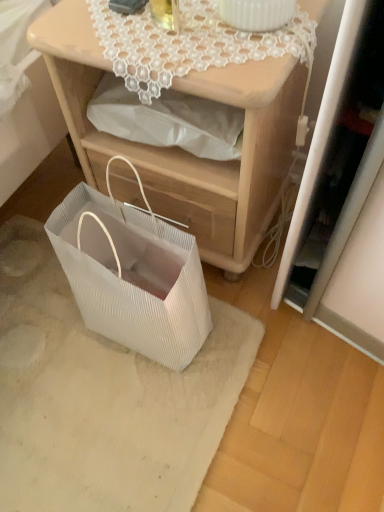
Question: From the image's perspective, relative to matte wood nightstand at center, is white pleated paper bag at lower left above or below?

Choices:
 (A) below
 (B) above

Answer: (A)

Question: Is point (82, 183) positioned closer to the camera than point (200, 210)?

Choices:
 (A) farther
 (B) closer

Answer: (B)

Question: Considering the real-world distances, which object is closest to the white lace doily at upper center?

Choices:
 (A) matte wood nightstand at center
 (B) white pleated paper bag at lower left
 (C) white textured mat at lower left

Answer: (A)

Question: Which is farther from the matte wood nightstand at center?

Choices:
 (A) white lace doily at upper center
 (B) white pleated paper bag at lower left
 (C) white textured mat at lower left

Answer: (C)